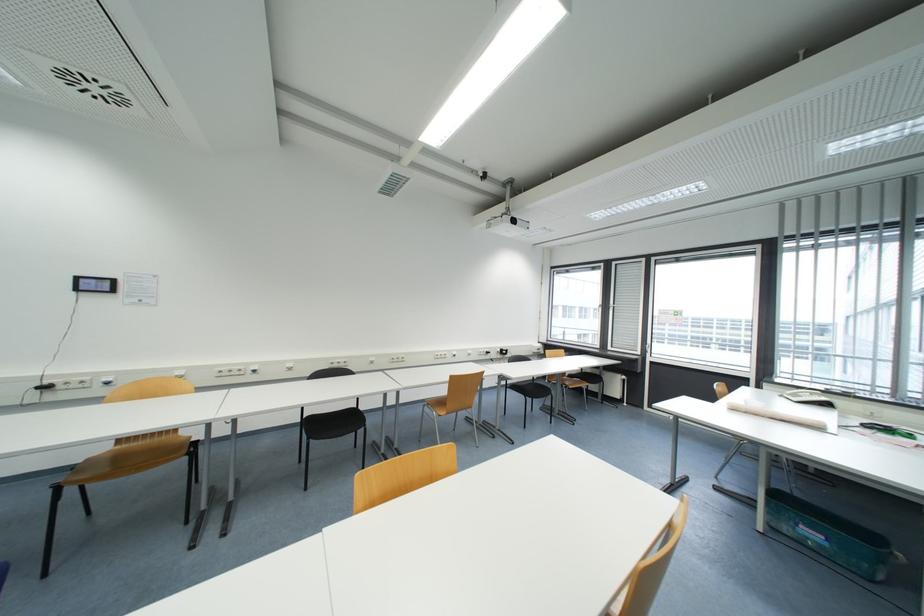
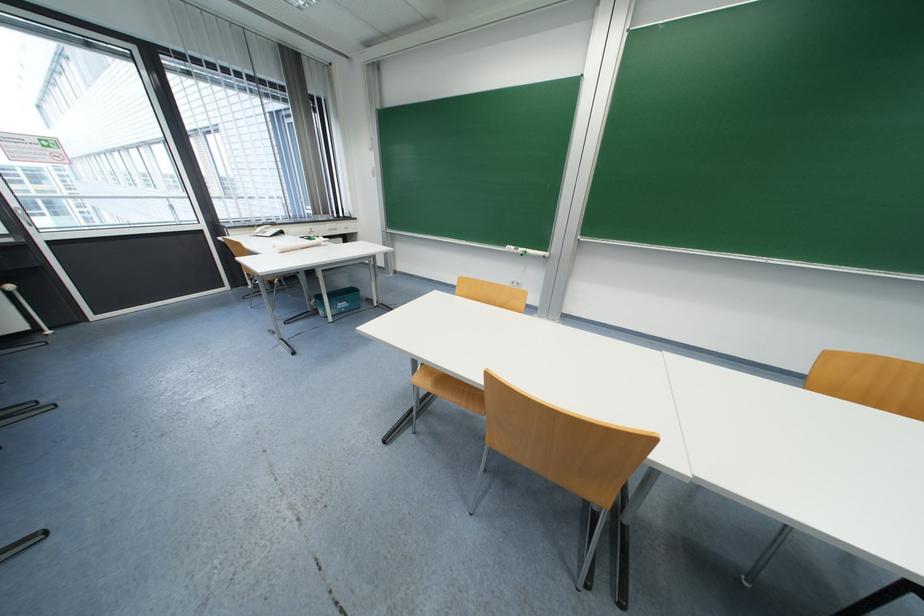
The point at (824,546) is marked in the first image. Where is the corresponding point in the second image?

(350, 310)